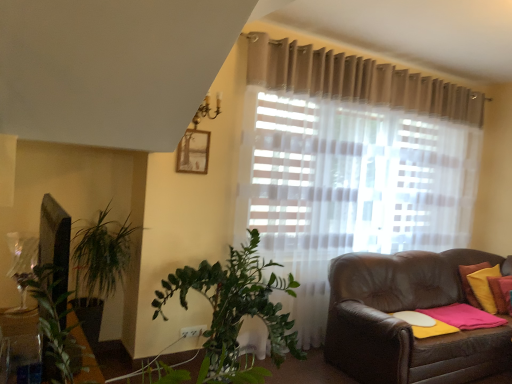
Question: Can you confirm if matte wooden picture frame at upper center is positioned to the right of yellow fabric pillow at right, which ranks as the first pillow in left-to-right order?

Choices:
 (A) no
 (B) yes

Answer: (A)

Question: Is the surface of matte wooden picture frame at upper center in direct contact with yellow fabric pillow at right, which ranks as the first pillow in left-to-right order?

Choices:
 (A) no
 (B) yes

Answer: (A)

Question: Considering the relative sizes of matte wooden picture frame at upper center and yellow fabric pillow at right, which is counted as the 2th pillow, starting from the right, in the image provided, is matte wooden picture frame at upper center thinner than yellow fabric pillow at right, which is counted as the 2th pillow, starting from the right,?

Choices:
 (A) yes
 (B) no

Answer: (A)

Question: From a real-world perspective, does matte wooden picture frame at upper center sit lower than yellow fabric pillow at right, which is counted as the 2th pillow, starting from the right?

Choices:
 (A) no
 (B) yes

Answer: (A)

Question: Considering the relative sizes of matte wooden picture frame at upper center and yellow fabric pillow at right, which is counted as the 2th pillow, starting from the right, in the image provided, is matte wooden picture frame at upper center bigger than yellow fabric pillow at right, which is counted as the 2th pillow, starting from the right,?

Choices:
 (A) no
 (B) yes

Answer: (A)

Question: Does matte wooden picture frame at upper center come in front of yellow fabric pillow at right, which is counted as the 2th pillow, starting from the right?

Choices:
 (A) no
 (B) yes

Answer: (B)

Question: Is yellow fabric pillow at right, which is counted as the 2th pillow, starting from the right, thinner than matte wooden picture frame at upper center?

Choices:
 (A) no
 (B) yes

Answer: (A)

Question: Can you confirm if yellow fabric pillow at right, which is counted as the 2th pillow, starting from the right, is shorter than matte wooden picture frame at upper center?

Choices:
 (A) yes
 (B) no

Answer: (B)

Question: From a real-world perspective, is yellow fabric pillow at right, which is counted as the 2th pillow, starting from the right, located beneath matte wooden picture frame at upper center?

Choices:
 (A) yes
 (B) no

Answer: (A)

Question: Does yellow fabric pillow at right, which ranks as the first pillow in left-to-right order, appear on the right side of matte wooden picture frame at upper center?

Choices:
 (A) yes
 (B) no

Answer: (A)

Question: Does yellow fabric pillow at right, which is counted as the 2th pillow, starting from the right, have a smaller size compared to matte wooden picture frame at upper center?

Choices:
 (A) no
 (B) yes

Answer: (A)

Question: From the image's perspective, is yellow fabric pillow at right, which is counted as the 2th pillow, starting from the right, on top of matte wooden picture frame at upper center?

Choices:
 (A) yes
 (B) no

Answer: (B)

Question: Is yellow fabric pillow at right, which is counted as the 2th pillow, starting from the right, far away from yellow fabric pillow at right, which appears as the second pillow when viewed from the left?

Choices:
 (A) yes
 (B) no

Answer: (B)